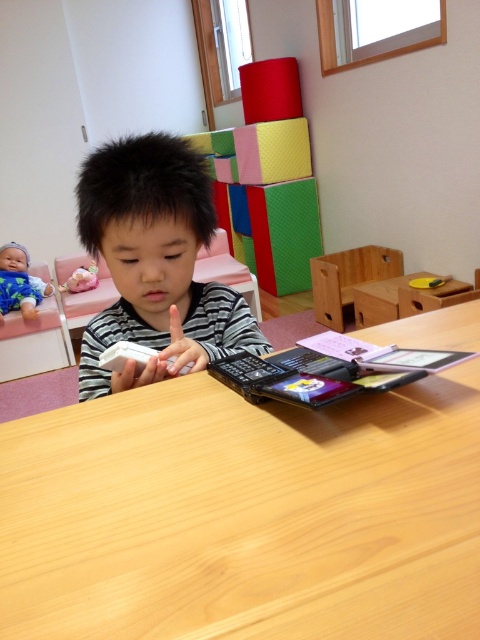
What do you see at coordinates (155, 262) in the screenshot? I see `black striped shirt at center` at bounding box center [155, 262].

Is point (200, 358) positioned before point (46, 294)?

Yes, it is.

Which is behind, point (189, 179) or point (27, 288)?

The point (27, 288) is behind.

Find the location of `black striped shirt at center`. black striped shirt at center is located at coordinates (155, 262).

Who is more forward, (15, 284) or (75, 291)?

Point (15, 284)

Measure the distance between blue fabric baby doll at upper left and camera.

A distance of 9.84 feet exists between blue fabric baby doll at upper left and camera.

Between point (6, 259) and point (96, 273), which one is positioned behind?

The point (96, 273) is behind.

Find the location of a particular element. The height and width of the screenshot is (640, 480). blue fabric baby doll at upper left is located at coordinates (19, 282).

Which of these two, wooden table at center or matte pink plush at left, stands taller?

wooden table at center

Does point (362, 595) come in front of point (71, 275)?

Yes, point (362, 595) is closer to viewer.

I want to click on wooden table at center, so click(243, 515).